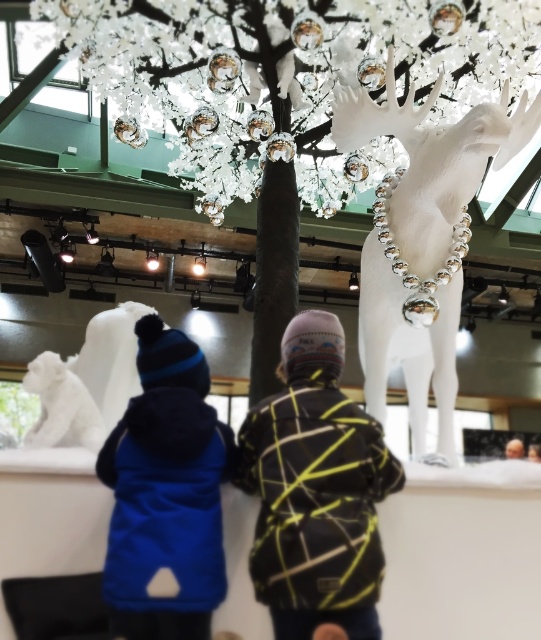
You are an artist planning to sketch the scene. You need to ensure that the white glossy deer at upper right and the blue soft vest at center are proportionally accurate. Which object should you draw first to maintain proper scaling?

The white glossy deer at upper right should be drawn first because it is larger than the blue soft vest at center, ensuring the scale is correctly proportioned before adding smaller elements.

You are standing in the museum and want to take a photo of the reindeer sculpture. There are two points marked in the image. Which point is better to stand at to get a closer view of the sculpture? The points are point [45,410] and point [512,456].

Point [45,410] is closer to the viewer than point [512,456], so standing at point [45,410] would provide a closer view of the reindeer sculpture.